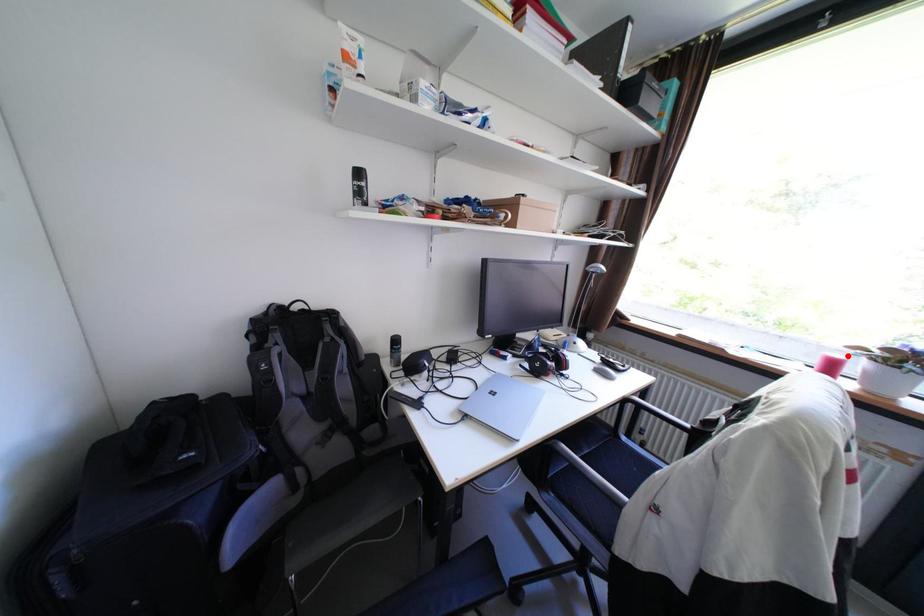
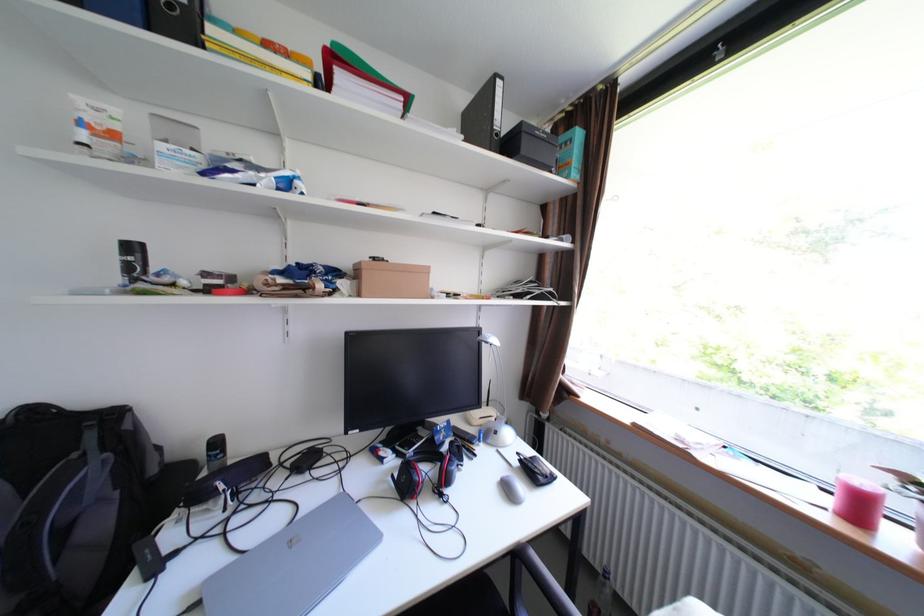
Locate, in the second image, the point that corresponds to the highlighted location in the first image.

(874, 484)